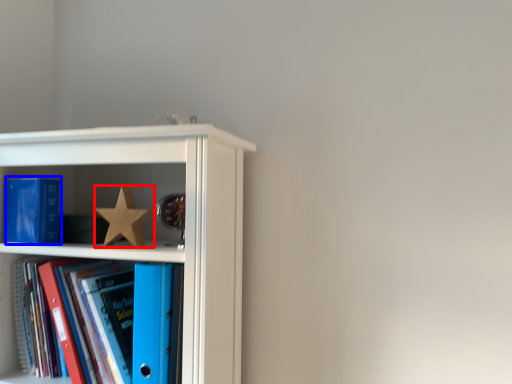
Question: Which point is further to the camera, star (highlighted by a red box) or paperback book (highlighted by a blue box)?

Choices:
 (A) star
 (B) paperback book

Answer: (B)